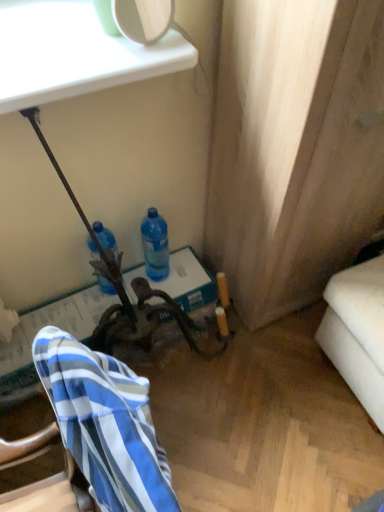
Question: Is blue translucent bottle at center, arranged as the 1th bottle when viewed from the left, positioned behind blue translucent bottle at center, placed as the first bottle when sorted from right to left?

Choices:
 (A) yes
 (B) no

Answer: (B)

Question: Considering the relative sizes of blue translucent bottle at center, arranged as the 1th bottle when viewed from the left, and blue translucent bottle at center, placed as the first bottle when sorted from right to left, in the image provided, is blue translucent bottle at center, arranged as the 1th bottle when viewed from the left, thinner than blue translucent bottle at center, placed as the first bottle when sorted from right to left,?

Choices:
 (A) no
 (B) yes

Answer: (A)

Question: From a real-world perspective, is blue translucent bottle at center, arranged as the 1th bottle when viewed from the left, beneath blue translucent bottle at center, placed as the first bottle when sorted from right to left?

Choices:
 (A) no
 (B) yes

Answer: (B)

Question: Considering the relative positions of blue translucent bottle at center, arranged as the 1th bottle when viewed from the left, and blue translucent bottle at center, which ranks as the 2th bottle in left-to-right order, in the image provided, is blue translucent bottle at center, arranged as the 1th bottle when viewed from the left, to the right of blue translucent bottle at center, which ranks as the 2th bottle in left-to-right order, from the viewer's perspective?

Choices:
 (A) no
 (B) yes

Answer: (A)

Question: Is blue translucent bottle at center, which is the second bottle from right to left, closer to camera compared to blue translucent bottle at center, which ranks as the 2th bottle in left-to-right order?

Choices:
 (A) no
 (B) yes

Answer: (B)

Question: Is blue translucent bottle at center, which is the second bottle from right to left, beside blue translucent bottle at center, which ranks as the 2th bottle in left-to-right order?

Choices:
 (A) yes
 (B) no

Answer: (B)

Question: Does blue translucent bottle at center, arranged as the 1th bottle when viewed from the left, have a lesser height compared to blue striped fabric at lower left?

Choices:
 (A) no
 (B) yes

Answer: (B)

Question: Considering the relative sizes of blue translucent bottle at center, which is the second bottle from right to left, and blue striped fabric at lower left in the image provided, is blue translucent bottle at center, which is the second bottle from right to left, smaller than blue striped fabric at lower left?

Choices:
 (A) no
 (B) yes

Answer: (B)

Question: Does blue translucent bottle at center, arranged as the 1th bottle when viewed from the left, have a larger size compared to blue striped fabric at lower left?

Choices:
 (A) yes
 (B) no

Answer: (B)

Question: Does blue translucent bottle at center, which is the second bottle from right to left, lie in front of blue striped fabric at lower left?

Choices:
 (A) no
 (B) yes

Answer: (A)

Question: Does blue translucent bottle at center, arranged as the 1th bottle when viewed from the left, appear on the right side of blue striped fabric at lower left?

Choices:
 (A) yes
 (B) no

Answer: (B)

Question: Are blue translucent bottle at center, which is the second bottle from right to left, and blue striped fabric at lower left far apart?

Choices:
 (A) no
 (B) yes

Answer: (A)

Question: From the image's perspective, would you say blue translucent bottle at center, placed as the first bottle when sorted from right to left, is shown under blue striped fabric at lower left?

Choices:
 (A) no
 (B) yes

Answer: (A)